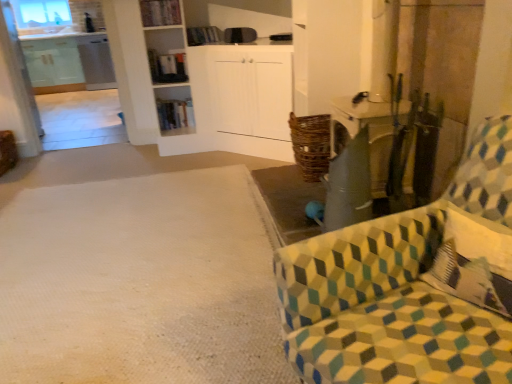
Identify the location of white textured carpet at lower left. Image resolution: width=512 pixels, height=384 pixels. (138, 282).

Identify the location of wooden bookshelf at upper center, arranged as the second shelf when viewed from the back. (160, 12).

Locate an element on the screen. Image resolution: width=512 pixels, height=384 pixels. patterned fabric chair at right is located at coordinates (411, 285).

Can you confirm if wooden bookshelf at center, which appears as the first shelf when ordered from the bottom, is bigger than patterned fabric chair at right?

No.

The image size is (512, 384). Identify the location of shelf below the patterned fabric chair at right (from a real-world perspective). (175, 110).

Is wooden bookshelf at center, the second shelf positioned from the top, inside the boundaries of patterned fabric chair at right, or outside?

The correct answer is: outside.

Does wooden bookshelf at center, the second shelf positioned from the top, appear on the left side of patterned fabric chair at right?

Correct, you'll find wooden bookshelf at center, the second shelf positioned from the top, to the left of patterned fabric chair at right.

In the scene shown: Considering the sizes of objects patterned fabric chair at right and white textured carpet at lower left in the image provided, who is thinner, patterned fabric chair at right or white textured carpet at lower left?

Thinner between the two is patterned fabric chair at right.

Considering the positions of objects patterned fabric chair at right and white textured carpet at lower left in the image provided, who is behind, patterned fabric chair at right or white textured carpet at lower left?

white textured carpet at lower left.

Considering the sizes of patterned fabric chair at right and white textured carpet at lower left in the image, is patterned fabric chair at right bigger or smaller than white textured carpet at lower left?

Considering their sizes, patterned fabric chair at right takes up more space than white textured carpet at lower left.

The width and height of the screenshot is (512, 384). Find the location of `plain behind the patterned fabric chair at right`. plain behind the patterned fabric chair at right is located at coordinates (138, 282).

Does point (85, 260) come in front of point (167, 13)?

Yes, it is in front of point (167, 13).

Who is shorter, white textured carpet at lower left or wooden bookshelf at upper center, positioned as the first shelf in front-to-back order?

white textured carpet at lower left is shorter.

Is white textured carpet at lower left next to wooden bookshelf at upper center, arranged as the second shelf when viewed from the back, and touching it?

white textured carpet at lower left and wooden bookshelf at upper center, arranged as the second shelf when viewed from the back, are clearly separated.

In terms of size, does wooden bookshelf at upper center, acting as the first shelf starting from the top, appear bigger or smaller than wooden bookshelf at center, marked as the 1th shelf in a back-to-front arrangement?

In the image, wooden bookshelf at upper center, acting as the first shelf starting from the top, appears to be smaller than wooden bookshelf at center, marked as the 1th shelf in a back-to-front arrangement.

Can you confirm if wooden bookshelf at upper center, acting as the first shelf starting from the top, is thinner than wooden bookshelf at center, which appears as the first shelf when ordered from the bottom?

Correct, the width of wooden bookshelf at upper center, acting as the first shelf starting from the top, is less than that of wooden bookshelf at center, which appears as the first shelf when ordered from the bottom.

Which is nearer, (147, 13) or (182, 130)?

Point (147, 13) is closer to the camera than point (182, 130).

Considering the relative positions of wooden bookshelf at upper center, which ranks as the 2th shelf in bottom-to-top order, and wooden bookshelf at center, which appears as the first shelf when ordered from the bottom, in the image provided, is wooden bookshelf at upper center, which ranks as the 2th shelf in bottom-to-top order, to the left or to the right of wooden bookshelf at center, which appears as the first shelf when ordered from the bottom,?

wooden bookshelf at upper center, which ranks as the 2th shelf in bottom-to-top order, is to the left of wooden bookshelf at center, which appears as the first shelf when ordered from the bottom.

Between white textured carpet at lower left and wooden bookshelf at center, which ranks as the 2th shelf in front-to-back order, which one appears on the right side from the viewer's perspective?

Positioned to the right is wooden bookshelf at center, which ranks as the 2th shelf in front-to-back order.

Does white textured carpet at lower left come behind wooden bookshelf at center, which appears as the first shelf when ordered from the bottom?

That is False.

From a real-world perspective, is white textured carpet at lower left positioned over wooden bookshelf at center, which appears as the first shelf when ordered from the bottom, based on gravity?

Actually, white textured carpet at lower left is physically below wooden bookshelf at center, which appears as the first shelf when ordered from the bottom, in the real world.

Based on the photo, between white textured carpet at lower left and wooden bookshelf at center, the second shelf positioned from the top, which one has less height?

white textured carpet at lower left is shorter.

Is wooden bookshelf at center, marked as the 1th shelf in a back-to-front arrangement, taller than transparent glass window at upper left?

Incorrect, the height of wooden bookshelf at center, marked as the 1th shelf in a back-to-front arrangement, is not larger of that of transparent glass window at upper left.

In terms of size, does wooden bookshelf at center, marked as the 1th shelf in a back-to-front arrangement, appear bigger or smaller than transparent glass window at upper left?

In the image, wooden bookshelf at center, marked as the 1th shelf in a back-to-front arrangement, appears to be smaller than transparent glass window at upper left.

From a real-world perspective, is wooden bookshelf at center, marked as the 1th shelf in a back-to-front arrangement, physically below transparent glass window at upper left?

Yes.

From a real-world perspective, between white textured carpet at lower left and patterned fabric chair at right, who is vertically higher?

In real-world perspective, patterned fabric chair at right is above.

From the image's perspective, would you say white textured carpet at lower left is positioned over patterned fabric chair at right?

Yes, from the image's perspective, white textured carpet at lower left is above patterned fabric chair at right.

Which of these two, white textured carpet at lower left or patterned fabric chair at right, is bigger?

patterned fabric chair at right.

Looking at this image, which object is further away from the camera taking this photo, white textured carpet at lower left or patterned fabric chair at right?

white textured carpet at lower left is further away from the camera.

This screenshot has width=512, height=384. Identify the location of the 2nd shelf behind when counting from the patterned fabric chair at right. (175, 110).

Where is `chair lying in front of the white textured carpet at lower left`? The width and height of the screenshot is (512, 384). chair lying in front of the white textured carpet at lower left is located at coordinates (411, 285).

Looking at the image, which one is located closer to white textured carpet at lower left, wooden bookshelf at center, which ranks as the 2th shelf in front-to-back order, or wooden bookshelf at upper center, positioned as the first shelf in front-to-back order?

wooden bookshelf at center, which ranks as the 2th shelf in front-to-back order.

Based on the photo, from the image, which object appears to be farther from wooden bookshelf at upper center, which ranks as the 2th shelf in bottom-to-top order, white textured carpet at lower left or patterned fabric chair at right?

patterned fabric chair at right is further to wooden bookshelf at upper center, which ranks as the 2th shelf in bottom-to-top order.

When comparing their distances from transparent glass window at upper left, does wooden bookshelf at center, marked as the 1th shelf in a back-to-front arrangement, or white textured carpet at lower left seem closer?

wooden bookshelf at center, marked as the 1th shelf in a back-to-front arrangement, is positioned closer to the anchor transparent glass window at upper left.

In the scene shown: Looking at the image, which one is located further to patterned fabric chair at right, transparent glass window at upper left or wooden bookshelf at center, marked as the 1th shelf in a back-to-front arrangement?

transparent glass window at upper left is positioned further to the anchor patterned fabric chair at right.

Estimate the real-world distances between objects in this image. Which object is closer to wooden bookshelf at upper center, positioned as the first shelf in front-to-back order, wooden bookshelf at center, the second shelf positioned from the top, or white textured carpet at lower left?

wooden bookshelf at center, the second shelf positioned from the top, is closer to wooden bookshelf at upper center, positioned as the first shelf in front-to-back order.

Based on their spatial positions, is wooden bookshelf at upper center, arranged as the second shelf when viewed from the back, or patterned fabric chair at right closer to white textured carpet at lower left?

patterned fabric chair at right is closer to white textured carpet at lower left.

Based on their spatial positions, is transparent glass window at upper left or wooden bookshelf at center, marked as the 1th shelf in a back-to-front arrangement, closer to white textured carpet at lower left?

wooden bookshelf at center, marked as the 1th shelf in a back-to-front arrangement, is positioned closer to the anchor white textured carpet at lower left.

From the image, which object appears to be farther from wooden bookshelf at center, marked as the 1th shelf in a back-to-front arrangement, transparent glass window at upper left or patterned fabric chair at right?

Based on the image, patterned fabric chair at right appears to be further to wooden bookshelf at center, marked as the 1th shelf in a back-to-front arrangement.

This screenshot has height=384, width=512. I want to click on plain located between patterned fabric chair at right and wooden bookshelf at center, which appears as the first shelf when ordered from the bottom, in the depth direction, so click(x=138, y=282).

Locate an element on the screen. plain positioned between patterned fabric chair at right and wooden bookshelf at upper center, which ranks as the 2th shelf in bottom-to-top order, from near to far is located at coordinates (138, 282).

The image size is (512, 384). I want to click on plain between patterned fabric chair at right and transparent glass window at upper left in the front-back direction, so click(138, 282).

In order to click on shelf between white textured carpet at lower left and wooden bookshelf at center, marked as the 1th shelf in a back-to-front arrangement, from front to back in this screenshot , I will do `click(160, 12)`.